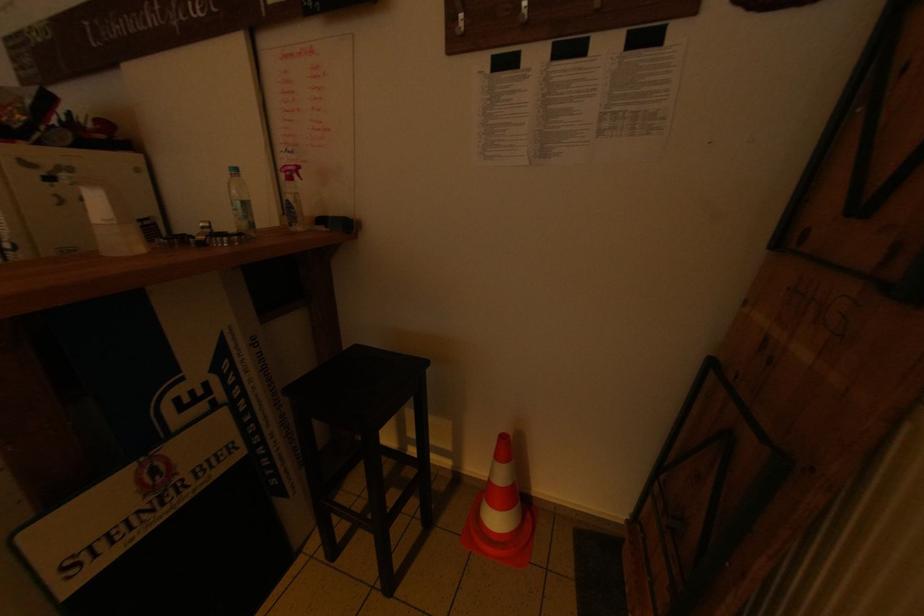
Where is `chair sitting surface`? chair sitting surface is located at coordinates (359, 387).